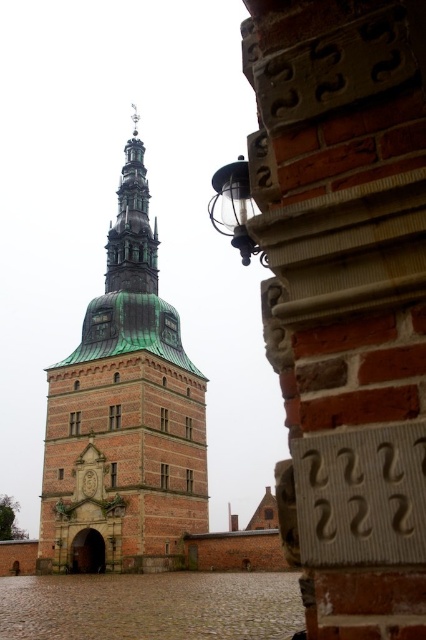
Does brown brick tower at center appear on the left side of green copper bell tower at upper center?

Correct, you'll find brown brick tower at center to the left of green copper bell tower at upper center.

Can you confirm if brown brick tower at center is positioned to the right of green copper bell tower at upper center?

Incorrect, brown brick tower at center is not on the right side of green copper bell tower at upper center.

Find the location of `brown brick tower at center`. brown brick tower at center is located at coordinates [124, 413].

Where is `brown brick tower at center`? brown brick tower at center is located at coordinates [124, 413].